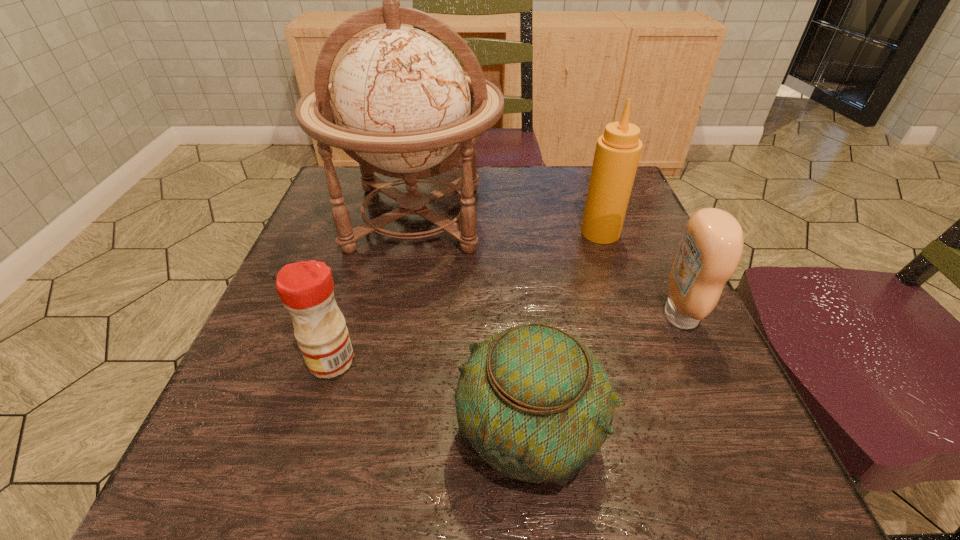
Find the location of a particular element. The image size is (960, 540). the tallest object is located at coordinates (400, 104).

Find the location of a particular element. The height and width of the screenshot is (540, 960). the fourth object from left to right is located at coordinates (618, 150).

At what (x,y) coordinates should I click in order to perform the action: click on the tallest condiment. Please return your answer as a coordinate pair (x, y). The width and height of the screenshot is (960, 540). Looking at the image, I should click on (618, 150).

Find the location of a particular element. the third nearest object is located at coordinates (711, 247).

Find the location of a particular element. The height and width of the screenshot is (540, 960). the rightmost condiment is located at coordinates (x=711, y=247).

Find the location of a particular element. This screenshot has height=540, width=960. the leftmost condiment is located at coordinates (306, 289).

Locate an element on the screen. Image resolution: width=960 pixels, height=540 pixels. pottery is located at coordinates (536, 404).

Locate an element on the screen. The image size is (960, 540). free space located 0.120m at the front of the tallest object showing Africa is located at coordinates (396, 318).

At what (x,y) coordinates should I click in order to perform the action: click on vacant space located on the left of the tallest condiment. Please return your answer as a coordinate pair (x, y). The height and width of the screenshot is (540, 960). Looking at the image, I should click on (496, 233).

Locate an element on the screen. This screenshot has height=540, width=960. free location located on the label of the rightmost condiment is located at coordinates (584, 316).